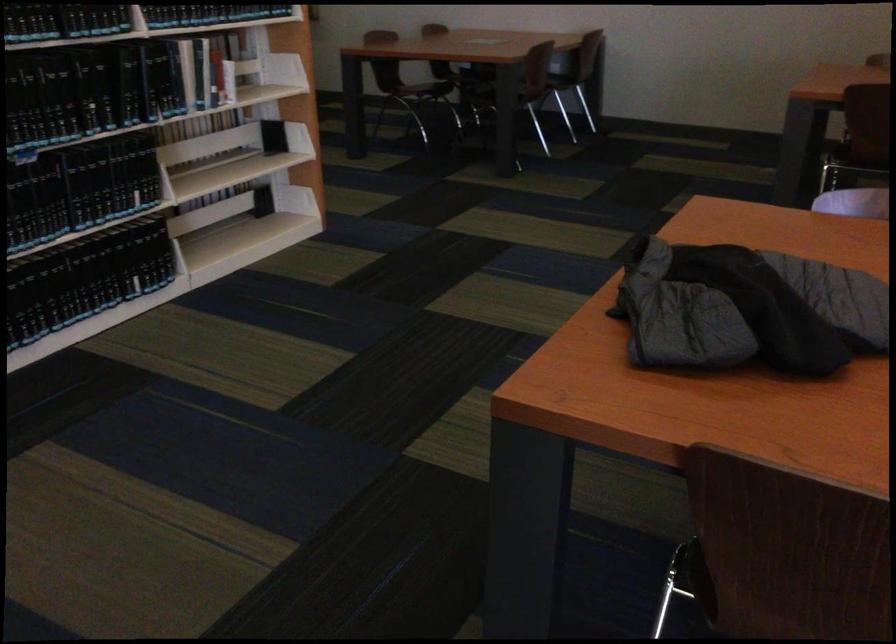
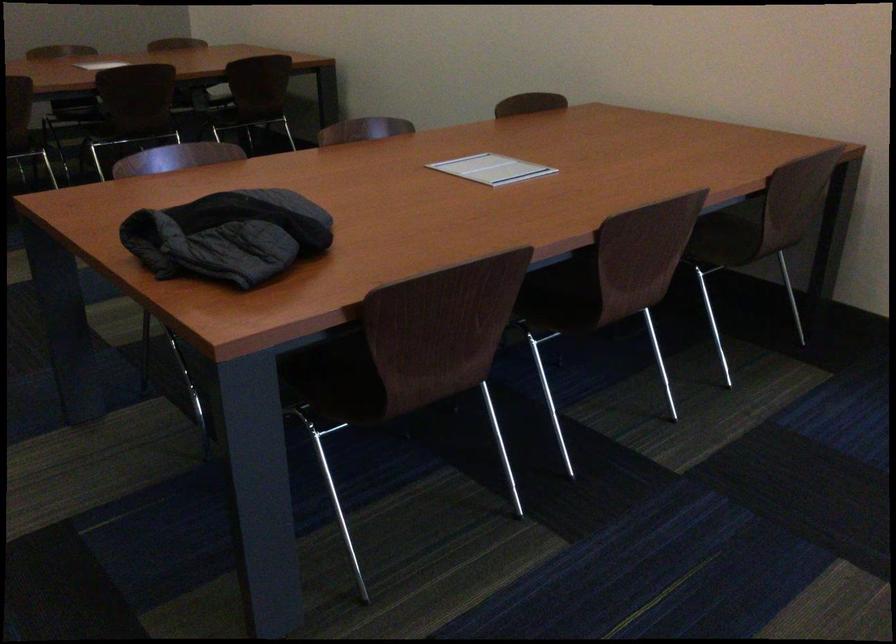
The point at (688,290) is marked in the first image. Where is the corresponding point in the second image?

(228, 236)